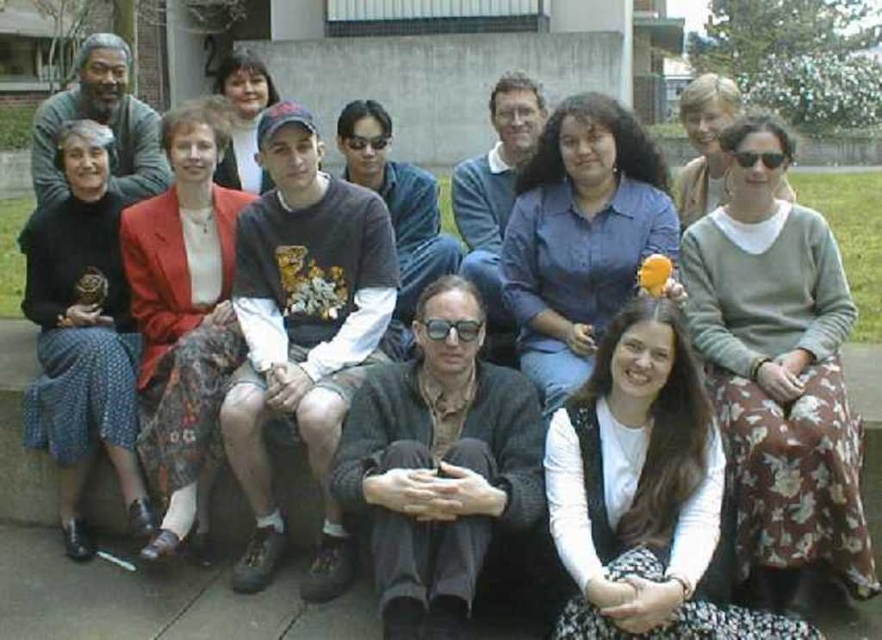
Does black matte sweater at center have a greater width compared to blue shirt at center?

Yes.

Which of these two, black matte sweater at center or blue shirt at center, stands taller?

black matte sweater at center is taller.

Is point (393, 531) positioned in front of point (550, 305)?

That is True.

Find the location of a particular element. black matte sweater at center is located at coordinates (439, 465).

Does dark gray t-shirt at center have a greater width compared to black matte sweater at center?

No, dark gray t-shirt at center is not wider than black matte sweater at center.

Which is in front, point (222, 440) or point (371, 468)?

Positioned in front is point (371, 468).

Is point (314, 294) farther from camera compared to point (497, 378)?

Yes, point (314, 294) is farther from viewer.

This screenshot has height=640, width=882. Find the location of `dark gray t-shirt at center`. dark gray t-shirt at center is located at coordinates (303, 332).

Does dark gray sweater at center have a lesser width compared to matte black jacket at upper center?

Indeed, dark gray sweater at center has a lesser width compared to matte black jacket at upper center.

Does dark gray sweater at center have a greater height compared to matte black jacket at upper center?

In fact, dark gray sweater at center may be shorter than matte black jacket at upper center.

Between point (427, 188) and point (243, 109), which one is positioned behind?

The point (243, 109) is more distant.

Image resolution: width=882 pixels, height=640 pixels. Identify the location of dark gray sweater at center. pyautogui.click(x=397, y=212).